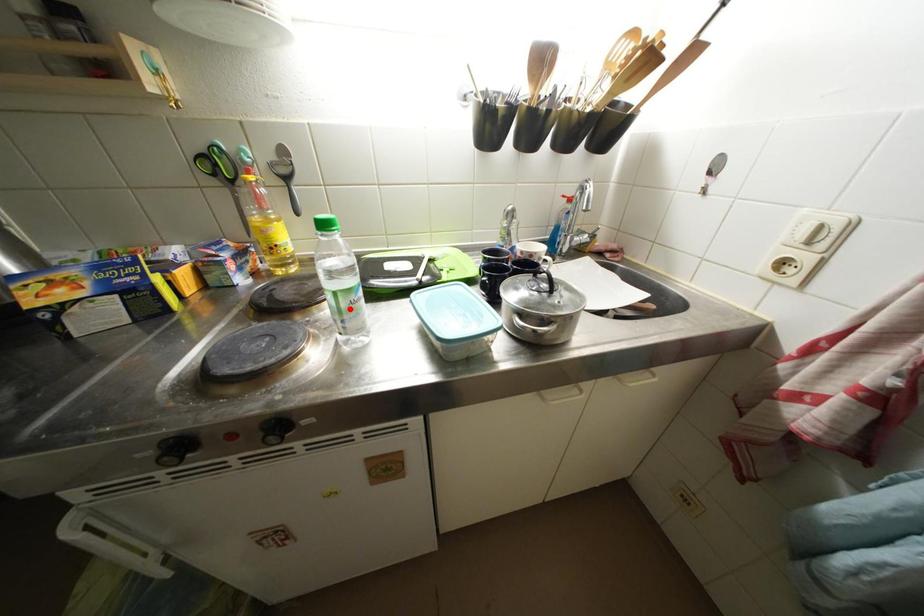
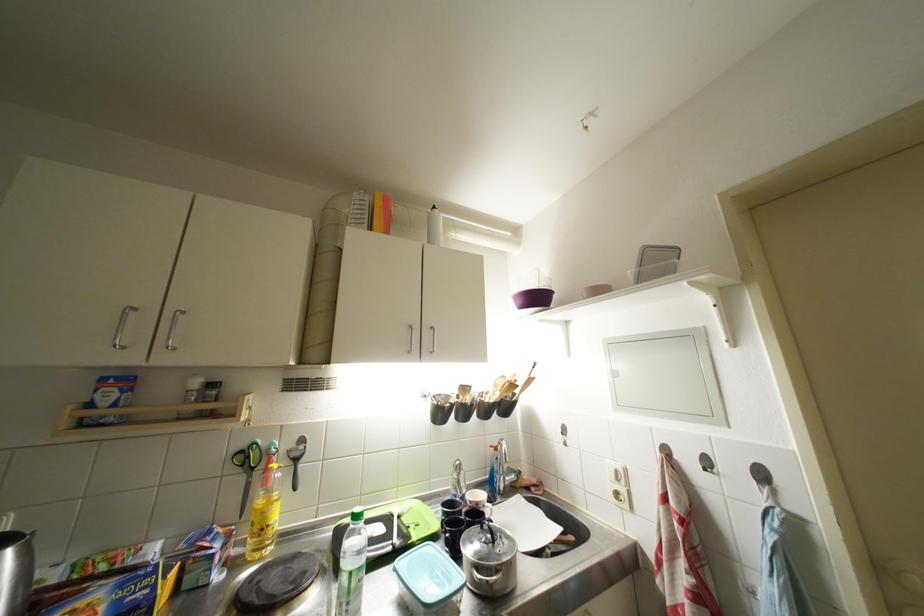
Locate, in the second image, the point that corresponds to the highlighted location in the first image.

(359, 589)